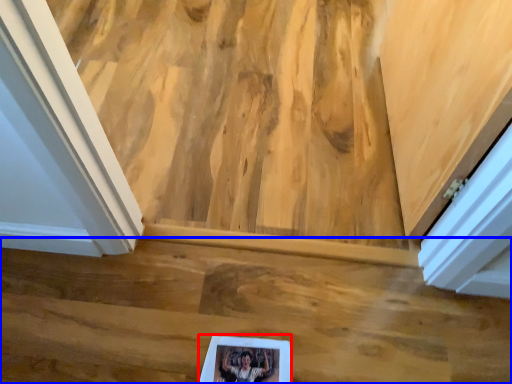
Question: Which object is further to the camera taking this photo, picture frame (highlighted by a red box) or stairwell (highlighted by a blue box)?

Choices:
 (A) picture frame
 (B) stairwell

Answer: (B)